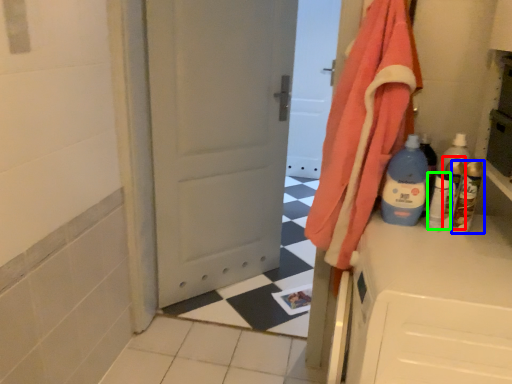
Question: Which object is the closest to the bottle (highlighted by a red box)? Choose among these: bottle (highlighted by a blue box) or bottle (highlighted by a green box).

Choices:
 (A) bottle
 (B) bottle

Answer: (B)